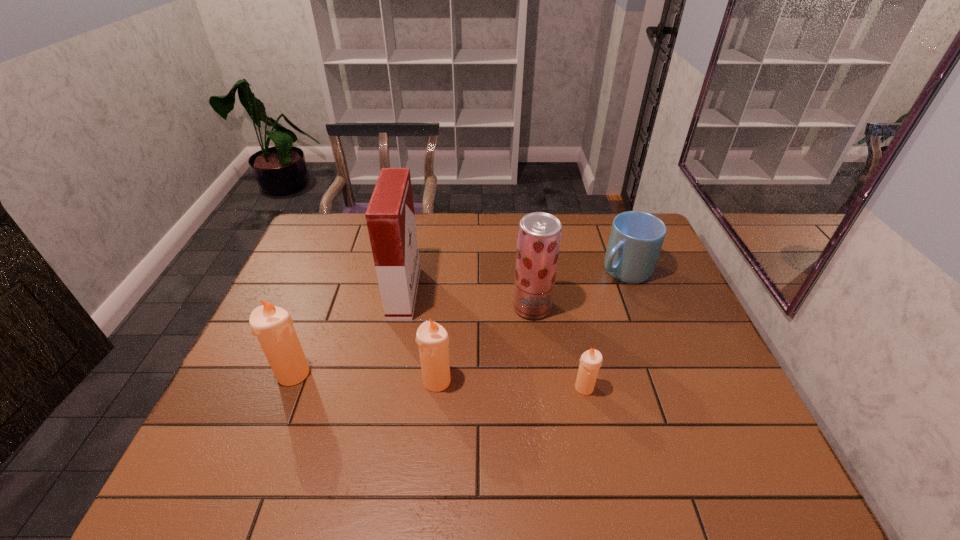
Identify the location of free region at the right edge of the desktop. (652, 308).

Image resolution: width=960 pixels, height=540 pixels. Identify the location of empty space between the mug and the fourth object from left to right. (578, 289).

Find the location of a particular element. The width and height of the screenshot is (960, 540). vacant space that is in between the shortest candle and the fruit juice is located at coordinates (558, 347).

In order to click on free space between the leftmost object and the rightmost object in this screenshot , I will do `click(459, 322)`.

Find the location of a particular element. unoccupied position between the fourth tallest object and the fruit juice is located at coordinates pyautogui.click(x=485, y=344).

Where is `blank region between the fourth object from right to left and the third object from right to left`? This screenshot has height=540, width=960. blank region between the fourth object from right to left and the third object from right to left is located at coordinates (485, 344).

Image resolution: width=960 pixels, height=540 pixels. Find the location of `unoccupied position between the leftmost object and the mug`. unoccupied position between the leftmost object and the mug is located at coordinates (459, 322).

The height and width of the screenshot is (540, 960). Identify the location of blank region between the leftmost object and the cigarette_case. (348, 333).

Identify the location of vacant point located between the mug and the fifth object from left to right. (604, 329).

This screenshot has height=540, width=960. Find the location of `object that is the fourth closest to the fruit juice`. object that is the fourth closest to the fruit juice is located at coordinates (390, 217).